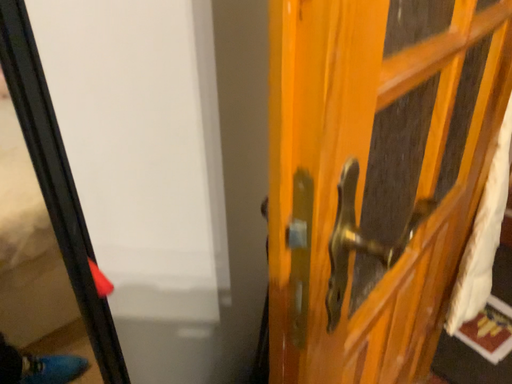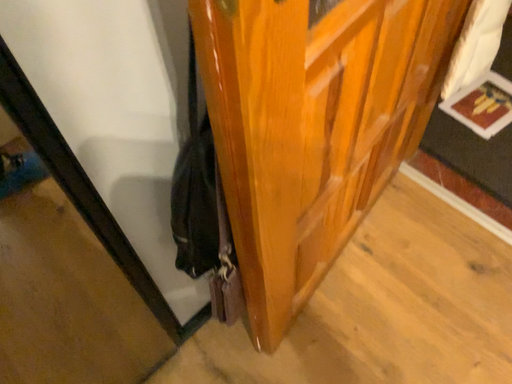
Question: Which way did the camera rotate in the video?

Choices:
 (A) rotated upward
 (B) rotated downward

Answer: (B)